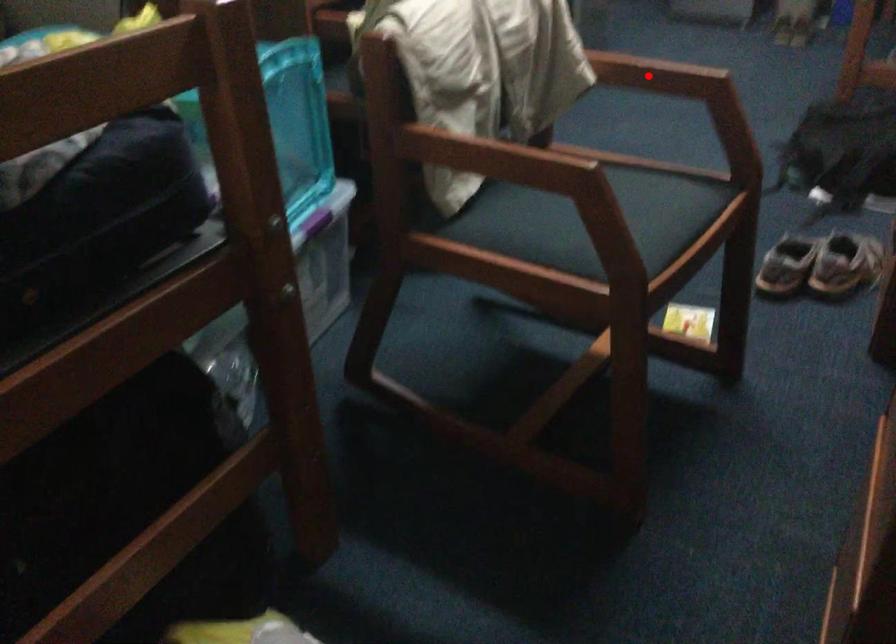
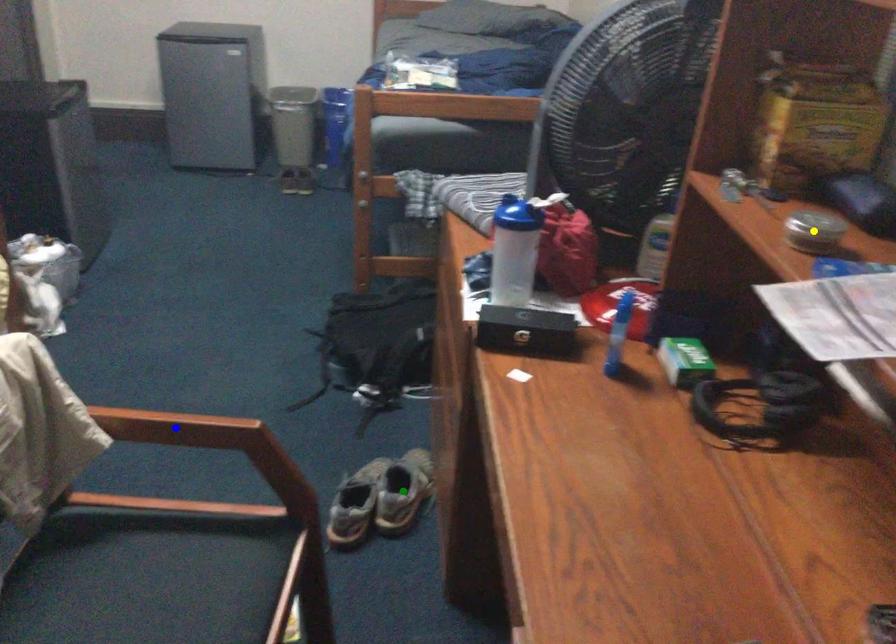
Question: I am providing you with two images of the same scene from different viewpoints. A red point is marked on the first image. You are given multiple points on the second image. Which mark in image 2 goes with the point in image 1?

Choices:
 (A) green point
 (B) yellow point
 (C) blue point

Answer: (C)